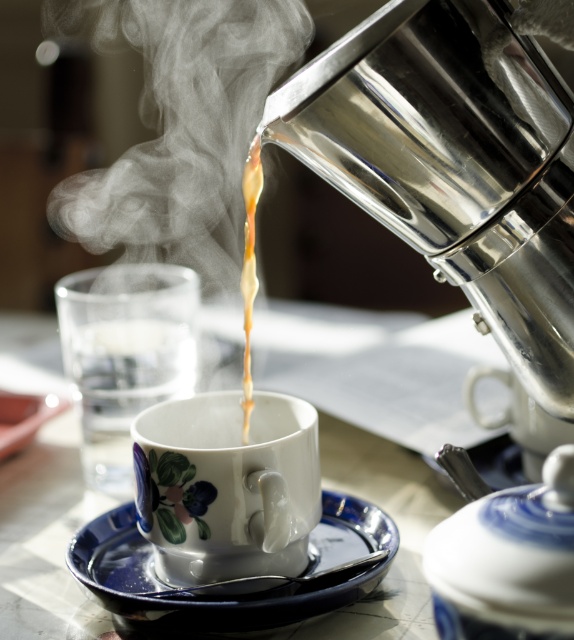
Describe the element at coordinates (507, 561) in the screenshot. The image size is (574, 640). I see `blue glazed teapot at right` at that location.

This screenshot has width=574, height=640. Find the location of `blue glazed teapot at right`. blue glazed teapot at right is located at coordinates (507, 561).

Does point (490, 584) come closer to viewer compared to point (250, 280)?

Yes, point (490, 584) is closer to viewer.

Where is `blue glazed teapot at right`? This screenshot has width=574, height=640. blue glazed teapot at right is located at coordinates (507, 561).

Does point (327, 560) come in front of point (502, 620)?

That is False.

Is blue glossy saucer at lower center taller than blue glazed teapot at right?

No.

Which is in front, point (343, 508) or point (552, 627)?

Positioned in front is point (552, 627).

Locate an element on the screen. This screenshot has height=640, width=574. blue glossy saucer at lower center is located at coordinates (236, 580).

Locate an element on the screen. porcelain floral cup at center is located at coordinates (226, 484).

Which of these two, porcelain floral cup at center or blue glossy saucer at lower center, stands taller?

With more height is porcelain floral cup at center.

Is point (196, 531) farther from camera compared to point (373, 579)?

No.

Find the location of a particular element. The height and width of the screenshot is (640, 574). porcelain floral cup at center is located at coordinates (226, 484).